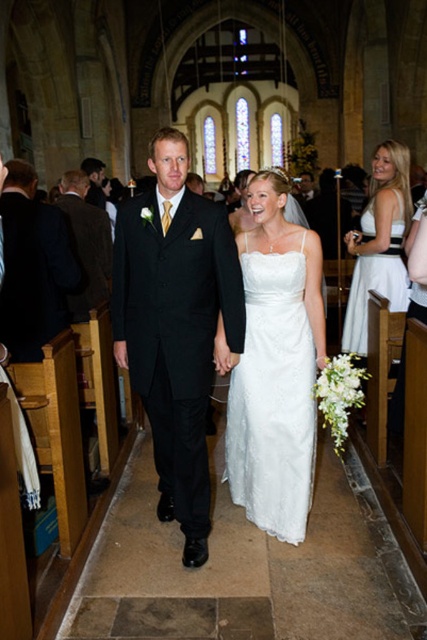
You are a photographer at the wedding and want to capture a photo of both the white lace dress at center and the white satin dress at right. Which dress is positioned lower in the frame?

The white lace dress at center is positioned lower in the frame because it is located below the white satin dress at right.

You are a photographer positioned at the back of the church during the wedding. You need to capture a photo of both the shiny black suit at center and the white satin dress at right. Considering their heights, which one might appear larger in the photo?

The shiny black suit at center is taller than the white satin dress at right, so it will appear larger in the photo.